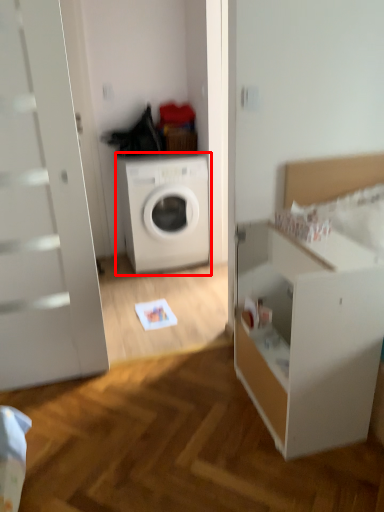
Question: From the image's perspective, where is washing machine (annotated by the red box) located in relation to dresser in the image?

Choices:
 (A) above
 (B) below

Answer: (A)